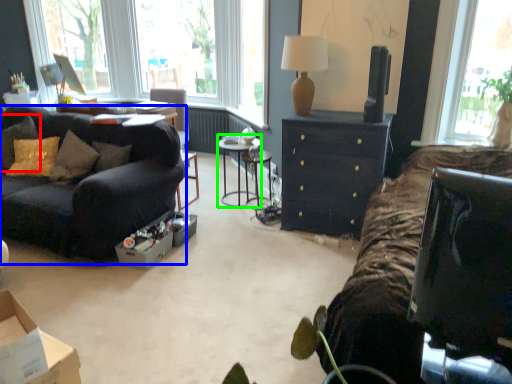
Question: Considering the real-world distances, which object is closest to pillow (highlighted by a red box)? studio couch (highlighted by a blue box) or side table (highlighted by a green box).

Choices:
 (A) studio couch
 (B) side table

Answer: (A)